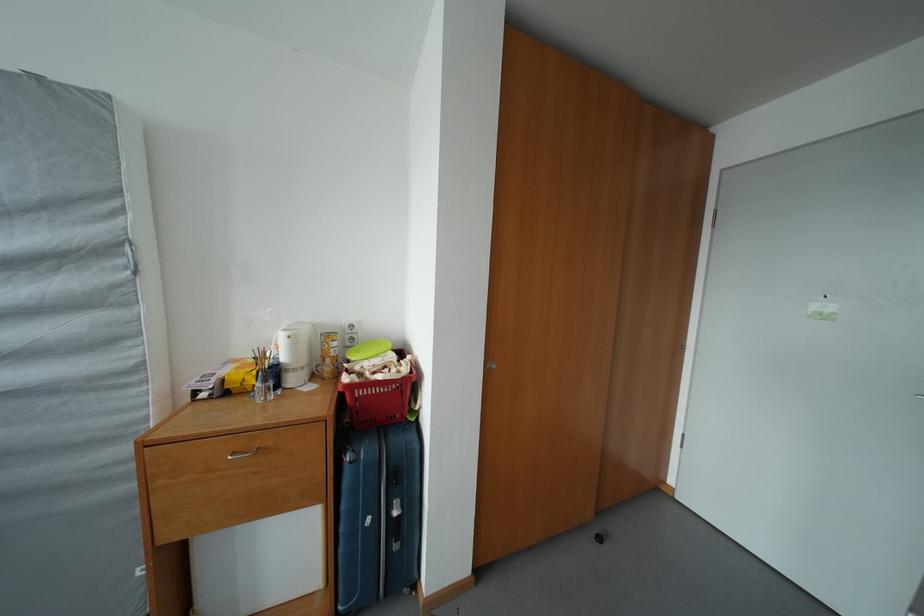
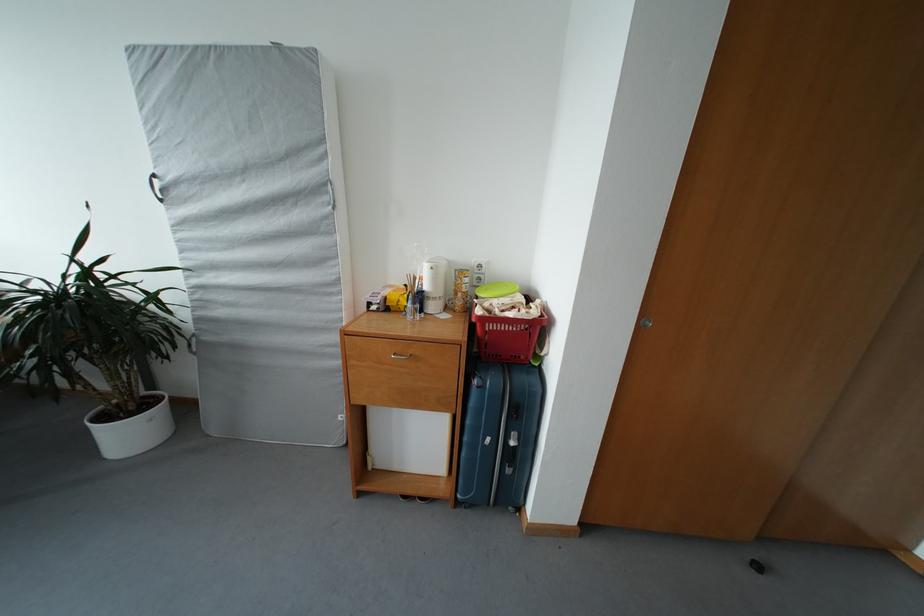
In the second image, find the point that corresponds to [301,375] in the first image.

(441, 304)